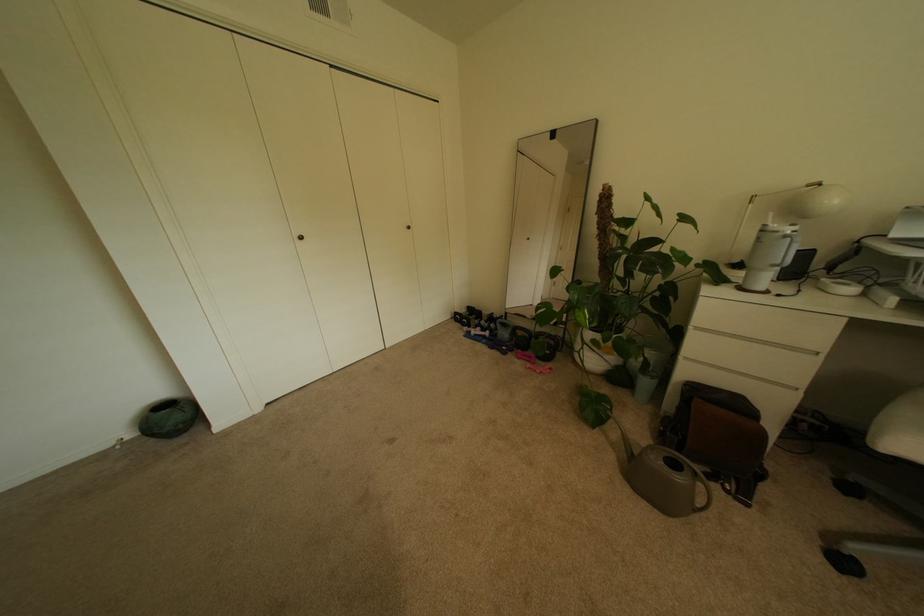
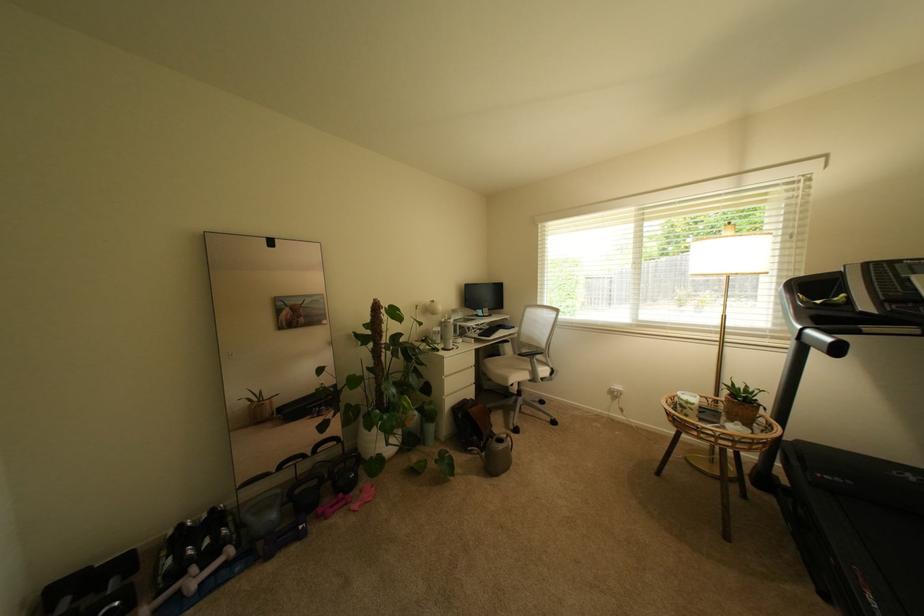
The point at (548,363) is marked in the first image. Where is the corresponding point in the second image?

(359, 495)